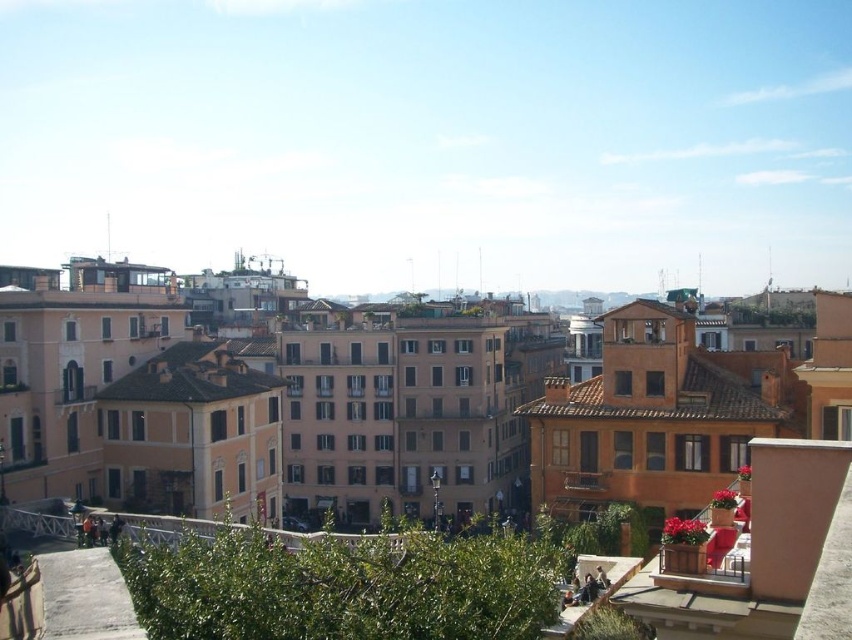
You are a city planner assessing the space between the wooden planter at lower right and the white metal railing at center. Which object takes up less space in the scene?

The wooden planter at lower right is smaller than the white metal railing at center, so it takes up less space in the scene.

From the picture: You are standing at the base of the stone staircase in the urban area. You want to place a small potted plant on the platform where people are sitting. The wooden planter at lower right is located at point (x=709, y=545). Can you determine if the wooden planter at lower right is on the platform where people are sitting?

The wooden planter at lower right is located at point (x=709, y=545), which is on the platform where people are sitting.

Consider the image. You are a gardener who wants to plant flowers in both the wooden planter at lower right and the wooden at center. Which planter do you think can accommodate more flowers?

The wooden planter at lower right has a larger size compared to wooden at center, so it can accommodate more flowers.